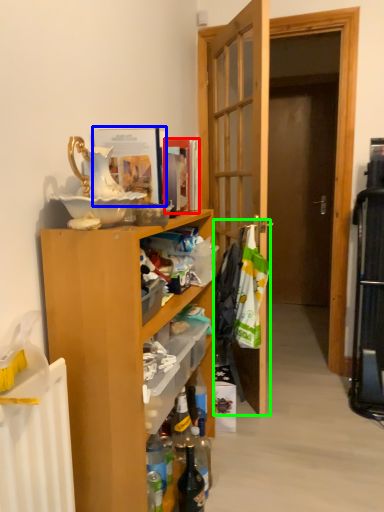
Question: Based on their relative distances, which object is nearer to magazine (highlighted by a red box)? Choose from magazine (highlighted by a blue box) and laundry (highlighted by a green box).

Choices:
 (A) magazine
 (B) laundry

Answer: (A)